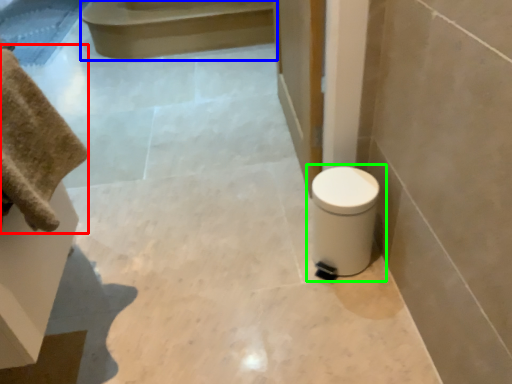
Question: Which object is the closest to the bath towel (highlighted by a red box)? Choose among these: stair (highlighted by a blue box) or toilet (highlighted by a green box).

Choices:
 (A) stair
 (B) toilet

Answer: (B)